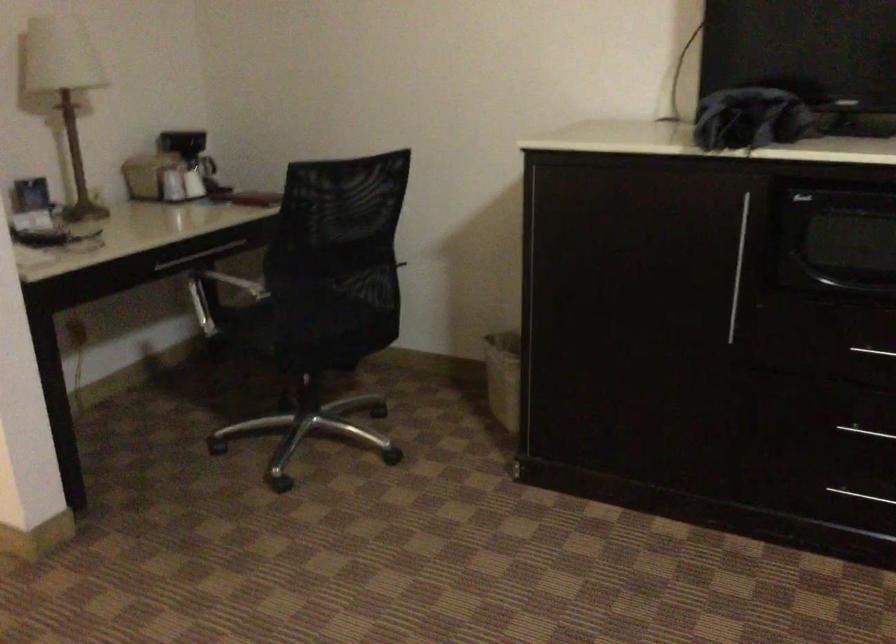
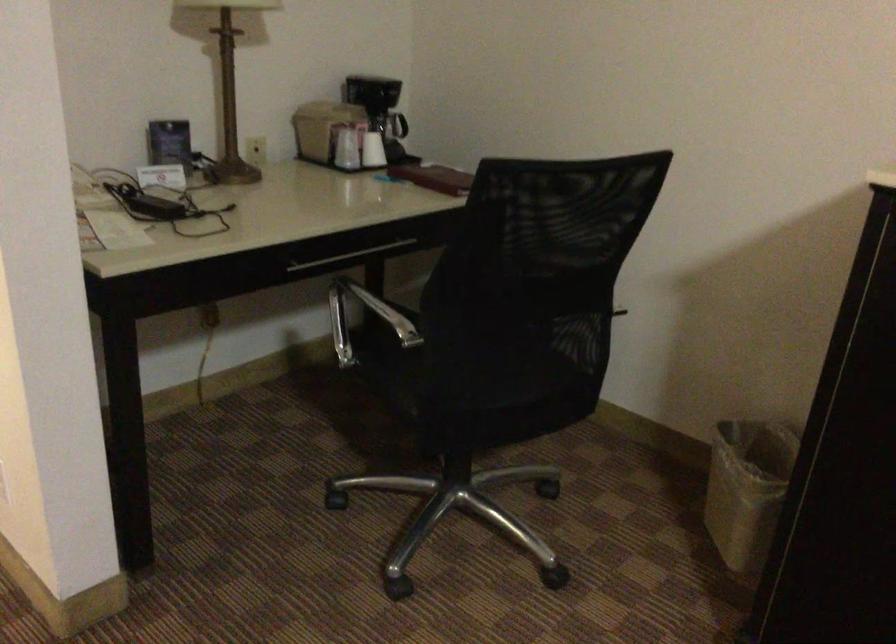
Question: In a continuous first-person perspective shot, in which direction is the camera moving?

Choices:
 (A) Left
 (B) Right
 (C) Forward
 (D) Backward

Answer: (C)